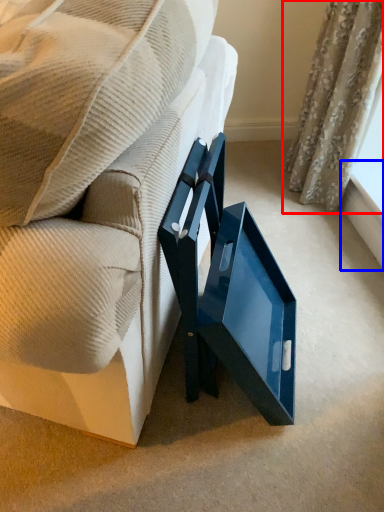
Question: Which object appears farthest to the camera in this image, curtain (highlighted by a red box) or window sill (highlighted by a blue box)?

Choices:
 (A) curtain
 (B) window sill

Answer: (B)